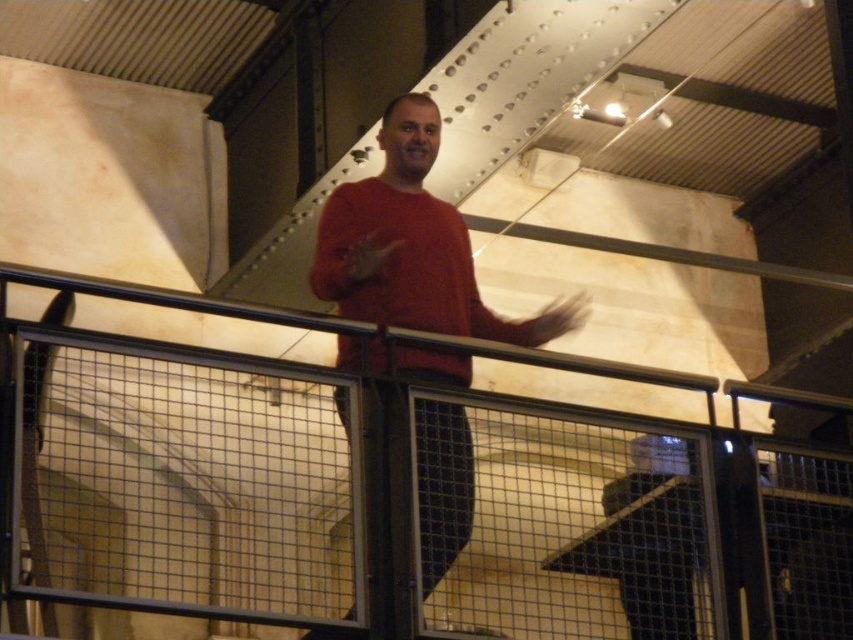
Which of these two, matte red sweater at center or black metal railing at upper center, stands shorter?

Standing shorter between the two is black metal railing at upper center.

Does matte red sweater at center have a greater height compared to black metal railing at upper center?

Correct, matte red sweater at center is much taller as black metal railing at upper center.

Does point (421, 148) lie behind point (143, 346)?

Yes, it is.

Find the location of `matte red sweater at center`. matte red sweater at center is located at coordinates (413, 246).